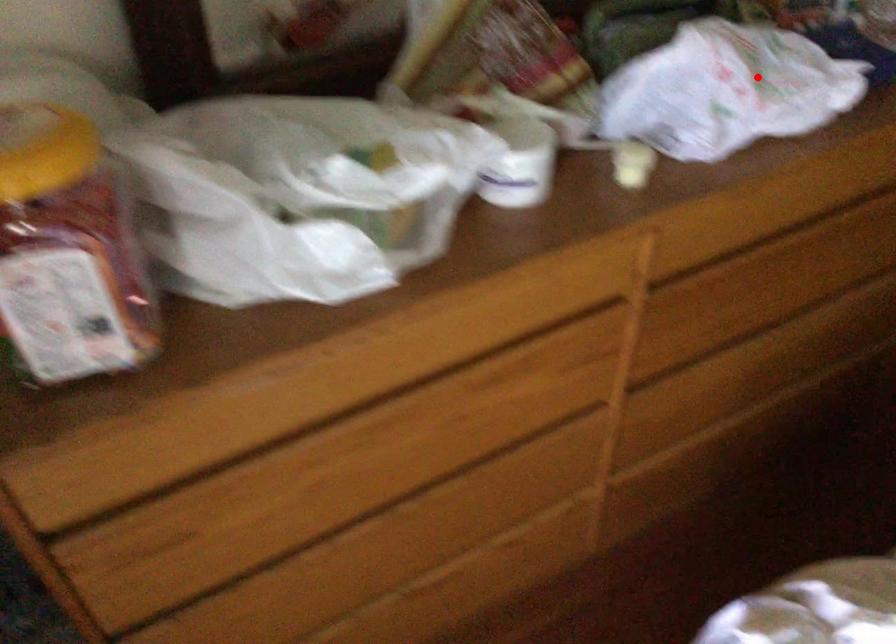
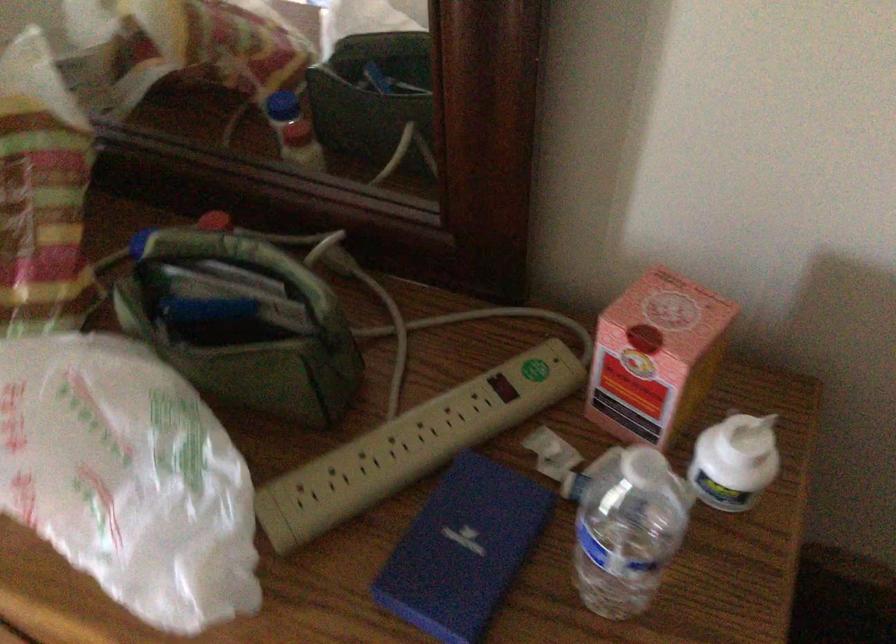
Question: I am providing you with two images of the same scene from different viewpoints. A red point is shown in image1. For the corresponding object point in image2, is it positioned nearer or farther from the camera?

Choices:
 (A) Nearer
 (B) Farther

Answer: (A)